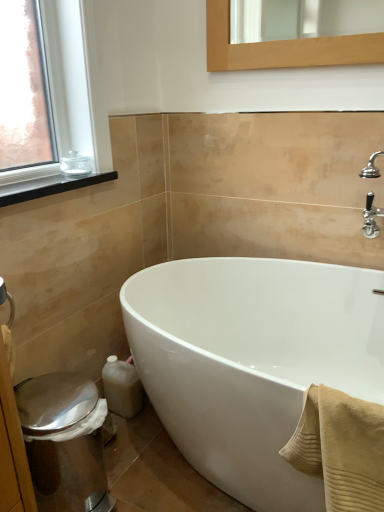
Where is `white glossy bathtub at center`? white glossy bathtub at center is located at coordinates (252, 361).

What are the coordinates of `black matte window sill at upper left` in the screenshot? It's located at (49, 186).

The height and width of the screenshot is (512, 384). I want to click on clear glass jar at upper left, so pos(75,165).

Looking at this image, is beige ribbed towel at lower right closer to camera compared to shiny metallic bidet at lower left?

Yes, beige ribbed towel at lower right is closer to the viewer.

Is beige ribbed towel at lower right far away from shiny metallic bidet at lower left?

beige ribbed towel at lower right is near shiny metallic bidet at lower left, not far away.

How far apart are beige ribbed towel at lower right and shiny metallic bidet at lower left?

beige ribbed towel at lower right is 28.23 inches from shiny metallic bidet at lower left.

From the picture: Which is closer to the camera, (68, 184) or (348, 295)?

Point (68, 184) appears to be closer to the viewer than point (348, 295).

Between black matte window sill at upper left and white glossy bathtub at center, which one appears on the right side from the viewer's perspective?

white glossy bathtub at center is more to the right.

Where is `bathtub directly beneath the black matte window sill at upper left (from a real-world perspective)`? bathtub directly beneath the black matte window sill at upper left (from a real-world perspective) is located at coordinates (252, 361).

Which of these two, black matte window sill at upper left or white glossy bathtub at center, stands shorter?

black matte window sill at upper left.

Where is `toiletry above the beige ribbed towel at lower right (from the image's perspective)`? This screenshot has width=384, height=512. toiletry above the beige ribbed towel at lower right (from the image's perspective) is located at coordinates (75, 165).

From the image's perspective, which is below, clear glass jar at upper left or beige ribbed towel at lower right?

beige ribbed towel at lower right is shown below in the image.

Does clear glass jar at upper left appear on the right side of beige ribbed towel at lower right?

In fact, clear glass jar at upper left is to the left of beige ribbed towel at lower right.

Considering the relative sizes of white glossy bathtub at center and clear glass jar at upper left in the image provided, is white glossy bathtub at center taller than clear glass jar at upper left?

Correct, white glossy bathtub at center is much taller as clear glass jar at upper left.

Can you tell me how much white glossy bathtub at center and clear glass jar at upper left differ in facing direction?

white glossy bathtub at center and clear glass jar at upper left are facing 89.4 degrees away from each other.

Between white glossy bathtub at center and clear glass jar at upper left, which one is positioned behind?

clear glass jar at upper left is more distant.

Is white glossy bathtub at center inside or outside of clear glass jar at upper left?

white glossy bathtub at center is located beyond the bounds of clear glass jar at upper left.

Considering the positions of objects white glossy bathtub at center and beige ribbed towel at lower right in the image provided, who is more to the left, white glossy bathtub at center or beige ribbed towel at lower right?

From the viewer's perspective, white glossy bathtub at center appears more on the left side.

Between white glossy bathtub at center and beige ribbed towel at lower right, which one has less height?

beige ribbed towel at lower right.

What's the angular difference between white glossy bathtub at center and beige ribbed towel at lower right's facing directions?

1.86 degrees.

Measure the distance between white glossy bathtub at center and beige ribbed towel at lower right.

white glossy bathtub at center is 74.19 centimeters away from beige ribbed towel at lower right.

Based on the photo, which is behind, beige ribbed towel at lower right or black matte window sill at upper left?

black matte window sill at upper left.

Is beige ribbed towel at lower right in contact with black matte window sill at upper left?

No, beige ribbed towel at lower right is not in contact with black matte window sill at upper left.

Is beige ribbed towel at lower right to the left of black matte window sill at upper left from the viewer's perspective?

Incorrect, beige ribbed towel at lower right is not on the left side of black matte window sill at upper left.

The height and width of the screenshot is (512, 384). What are the coordinates of `bath towel that appears below the black matte window sill at upper left (from a real-world perspective)` in the screenshot? It's located at (341, 448).

Which point is more forward, (302,500) or (38,442)?

Positioned in front is point (302,500).

Between white glossy bathtub at center and shiny metallic bidet at lower left, which one is positioned behind?

shiny metallic bidet at lower left is further from the camera.

Considering the positions of objects white glossy bathtub at center and shiny metallic bidet at lower left in the image provided, who is more to the left, white glossy bathtub at center or shiny metallic bidet at lower left?

shiny metallic bidet at lower left is more to the left.

How distant is white glossy bathtub at center from shiny metallic bidet at lower left?

white glossy bathtub at center and shiny metallic bidet at lower left are 23.74 inches apart.

The width and height of the screenshot is (384, 512). In the image, there is a beige ribbed towel at lower right. In order to click on bidet below it (from the image's perspective) in this screenshot , I will do `click(64, 441)`.

Locate an element on the screen. This screenshot has height=512, width=384. window sill above the white glossy bathtub at center (from a real-world perspective) is located at coordinates (49, 186).

When comparing their distances from white glossy bathtub at center, does shiny metallic bidet at lower left or beige ribbed towel at lower right seem closer?

Based on the image, shiny metallic bidet at lower left appears to be nearer to white glossy bathtub at center.

When comparing their distances from shiny metallic bidet at lower left, does white glossy bathtub at center or clear glass jar at upper left seem closer?

white glossy bathtub at center.

When comparing their distances from shiny metallic bidet at lower left, does clear glass jar at upper left or white glossy bathtub at center seem further?

clear glass jar at upper left.

Based on their spatial positions, is white glossy bathtub at center or shiny metallic bidet at lower left further from beige ribbed towel at lower right?

white glossy bathtub at center.

When comparing their distances from beige ribbed towel at lower right, does white glossy bathtub at center or black matte window sill at upper left seem closer?

white glossy bathtub at center.

Which object lies nearer to the anchor point white glossy bathtub at center, clear glass jar at upper left or beige ribbed towel at lower right?

beige ribbed towel at lower right is positioned closer to the anchor white glossy bathtub at center.

From the image, which object appears to be farther from black matte window sill at upper left, beige ribbed towel at lower right or clear glass jar at upper left?

The object further to black matte window sill at upper left is beige ribbed towel at lower right.

From the image, which object appears to be nearer to black matte window sill at upper left, white glossy bathtub at center or clear glass jar at upper left?

clear glass jar at upper left is closer to black matte window sill at upper left.

The height and width of the screenshot is (512, 384). I want to click on bathtub that lies between black matte window sill at upper left and shiny metallic bidet at lower left from top to bottom, so click(252, 361).

Locate an element on the screen. This screenshot has height=512, width=384. bathtub between clear glass jar at upper left and shiny metallic bidet at lower left vertically is located at coordinates (252, 361).

I want to click on bath towel between black matte window sill at upper left and shiny metallic bidet at lower left in the vertical direction, so click(341, 448).

At what (x,y) coordinates should I click in order to perform the action: click on bathtub situated between black matte window sill at upper left and beige ribbed towel at lower right from left to right. Please return your answer as a coordinate pair (x, y). The image size is (384, 512). Looking at the image, I should click on (252, 361).